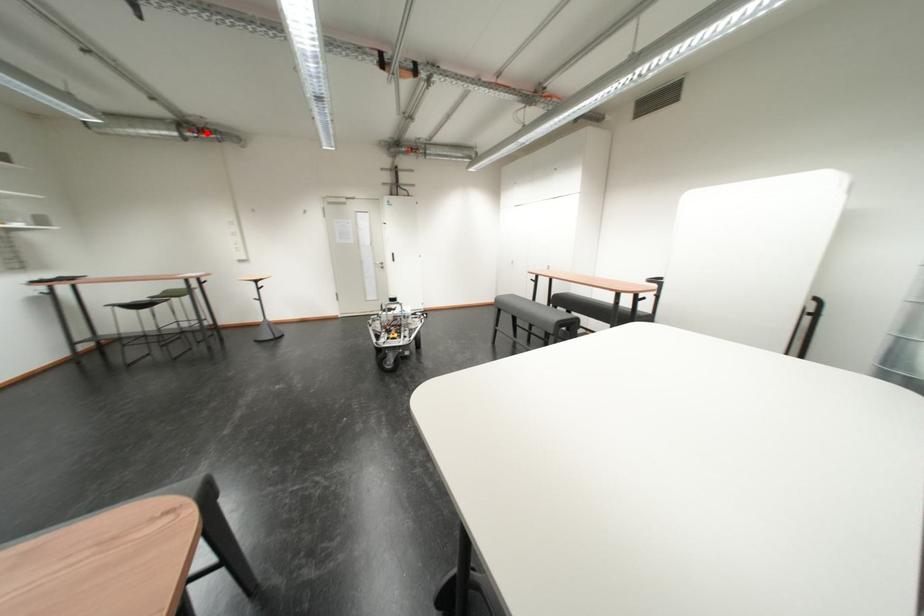
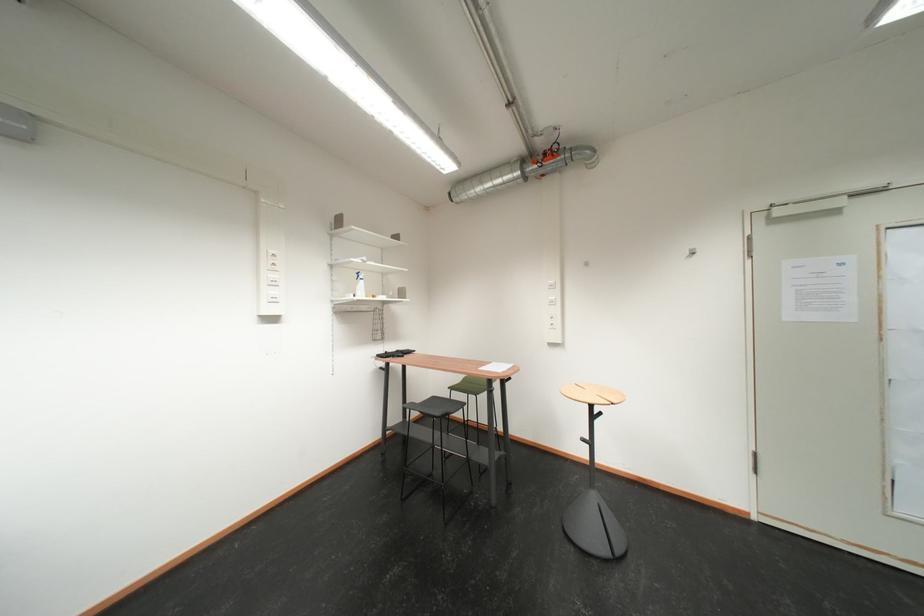
Question: I am providing you with two images of the same scene from different viewpoints. A red point is marked on the first image. Is the red point's position out of view in image 2?

Choices:
 (A) Yes
 (B) No

Answer: (B)